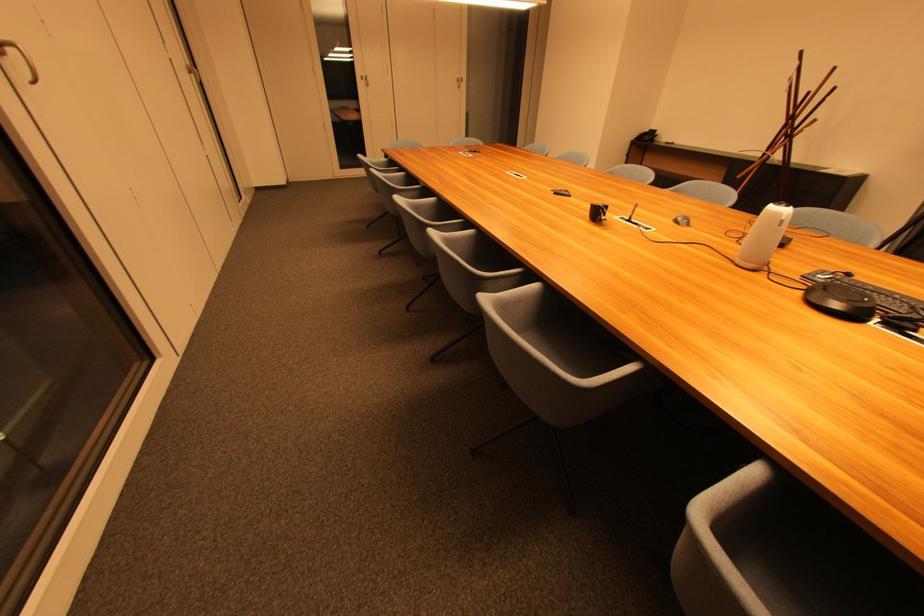
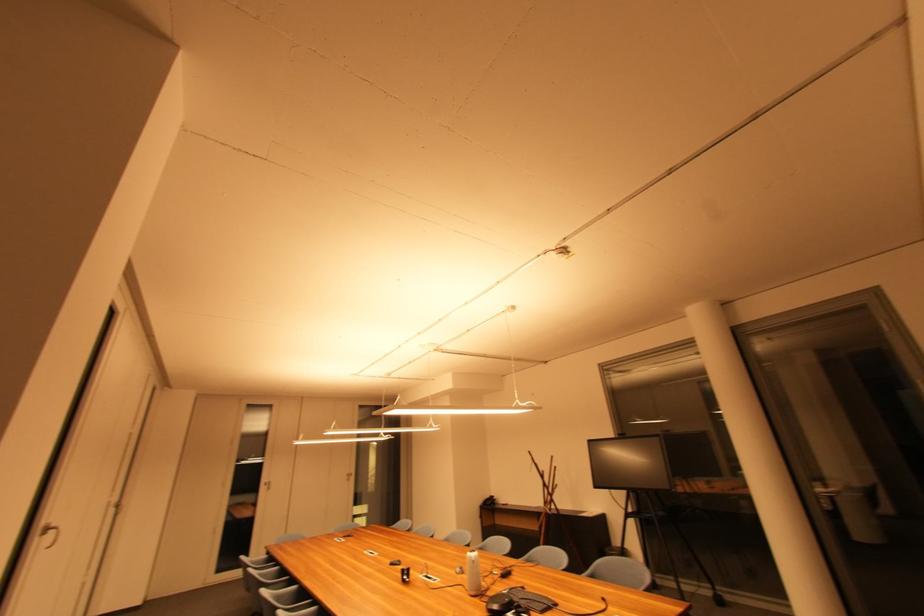
The point at (367,81) is marked in the first image. Where is the corresponding point in the second image?

(271, 485)